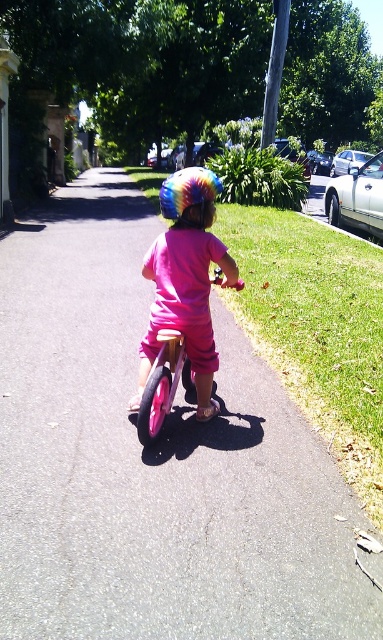
You are standing on the sidewalk and see two points marked on the road ahead. The first point is at coordinates point (147, 353) and the second point is at point (165, 216). Which point is closer to you?

Point (147, 353) is closer to you because it is further to the viewer than point (165, 216).

You are a delivery drone that needs to land on the smooth asphalt at center. However, there is a rainbow helmet at center in the way. Can you land on the asphalt without hitting the helmet?

The smooth asphalt at center is bigger than the rainbow helmet at center, so yes, the drone can land on the smooth asphalt at center while avoiding the rainbow helmet at center.